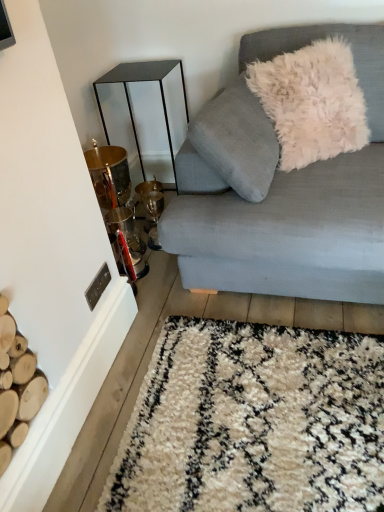
Question: Is light blue fabric couch at upper right placed right next to white fluffy pillow at upper right?

Choices:
 (A) yes
 (B) no

Answer: (B)

Question: Is light blue fabric couch at upper right looking in the opposite direction of white fluffy pillow at upper right?

Choices:
 (A) no
 (B) yes

Answer: (B)

Question: Does light blue fabric couch at upper right turn towards white fluffy pillow at upper right?

Choices:
 (A) yes
 (B) no

Answer: (A)

Question: Is light blue fabric couch at upper right thinner than white fluffy pillow at upper right?

Choices:
 (A) yes
 (B) no

Answer: (B)

Question: Is light blue fabric couch at upper right positioned in front of white fluffy pillow at upper right?

Choices:
 (A) yes
 (B) no

Answer: (A)

Question: Could white fluffy pillow at upper right be considered to be inside light blue fabric couch at upper right?

Choices:
 (A) yes
 (B) no

Answer: (A)

Question: Can you confirm if white fluffy pillow at upper right is positioned to the right of metallic gold table at left?

Choices:
 (A) no
 (B) yes

Answer: (B)

Question: Does white fluffy pillow at upper right come behind metallic gold table at left?

Choices:
 (A) no
 (B) yes

Answer: (A)

Question: Can you confirm if white fluffy pillow at upper right is wider than metallic gold table at left?

Choices:
 (A) no
 (B) yes

Answer: (A)

Question: From the image's perspective, is white fluffy pillow at upper right beneath metallic gold table at left?

Choices:
 (A) no
 (B) yes

Answer: (A)

Question: From a real-world perspective, is white fluffy pillow at upper right physically below metallic gold table at left?

Choices:
 (A) yes
 (B) no

Answer: (B)

Question: Would you say metallic gold table at left is part of white fluffy pillow at upper right's contents?

Choices:
 (A) no
 (B) yes

Answer: (A)

Question: Can you confirm if white fluffy pillow at upper right is taller than light blue fabric couch at upper right?

Choices:
 (A) no
 (B) yes

Answer: (A)